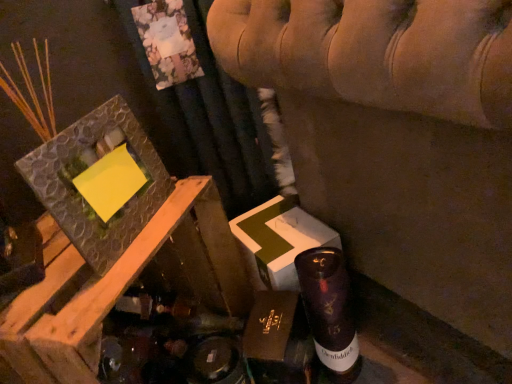
Question: Is point (305, 342) positioned closer to the camera than point (438, 97)?

Choices:
 (A) farther
 (B) closer

Answer: (A)

Question: Considering the positions of brown cardboard box at center and velvet beige sofa at upper center in the image, is brown cardboard box at center wider or thinner than velvet beige sofa at upper center?

Choices:
 (A) thin
 (B) wide

Answer: (A)

Question: Estimate the real-world distances between objects in this image. Which object is closer to the velvet beige sofa at upper center?

Choices:
 (A) brown cardboard box at center
 (B) textured stone picture frame at upper left
 (C) shiny purple glass bottle at lower right

Answer: (C)

Question: Estimate the real-world distances between objects in this image. Which object is closer to the brown cardboard box at center?

Choices:
 (A) velvet beige sofa at upper center
 (B) shiny purple glass bottle at lower right
 (C) textured stone picture frame at upper left

Answer: (B)